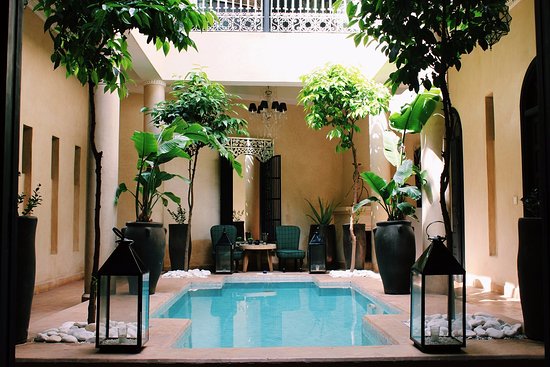
Identify the location of railing on the upper area on the right side. (308, 16).